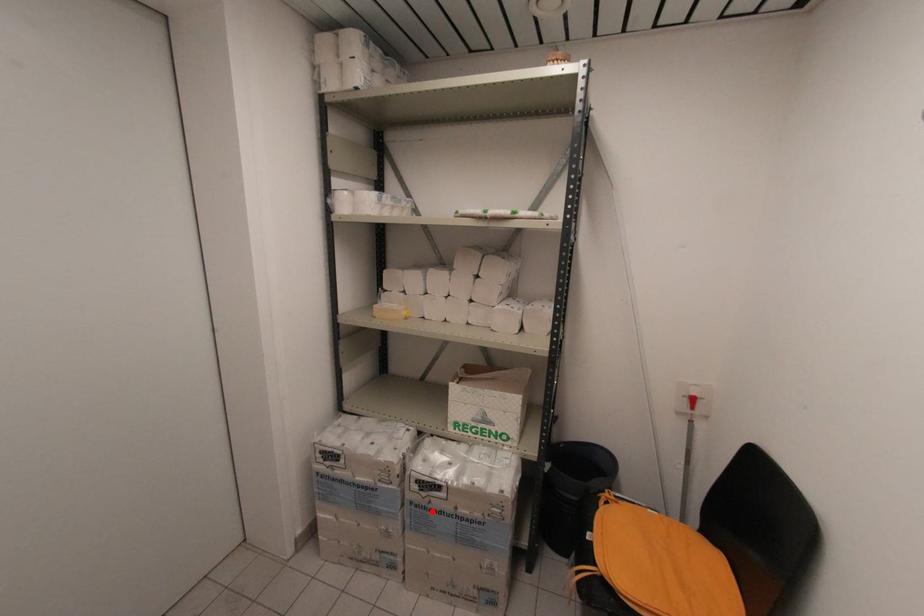
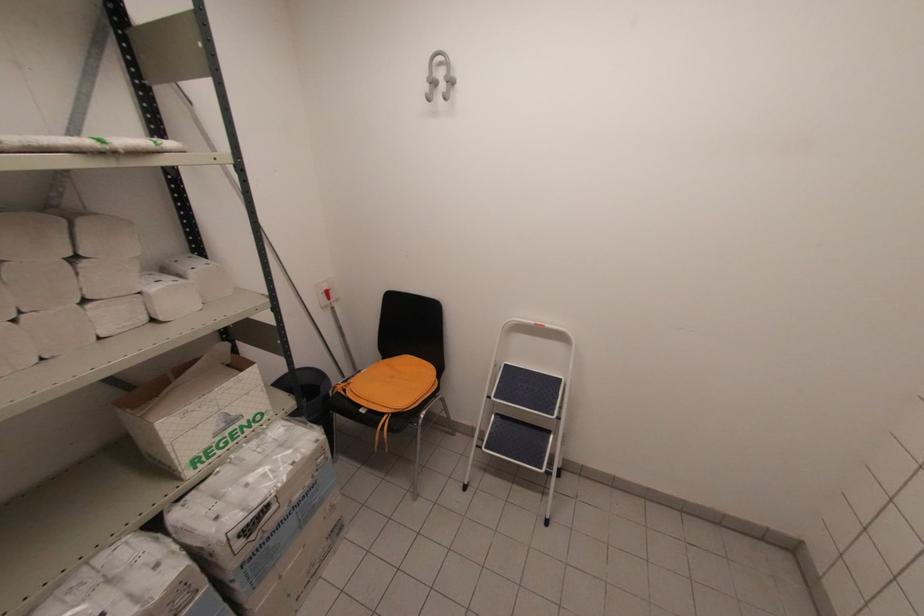
In the second image, find the point that corresponds to the highlighted location in the first image.

(271, 539)